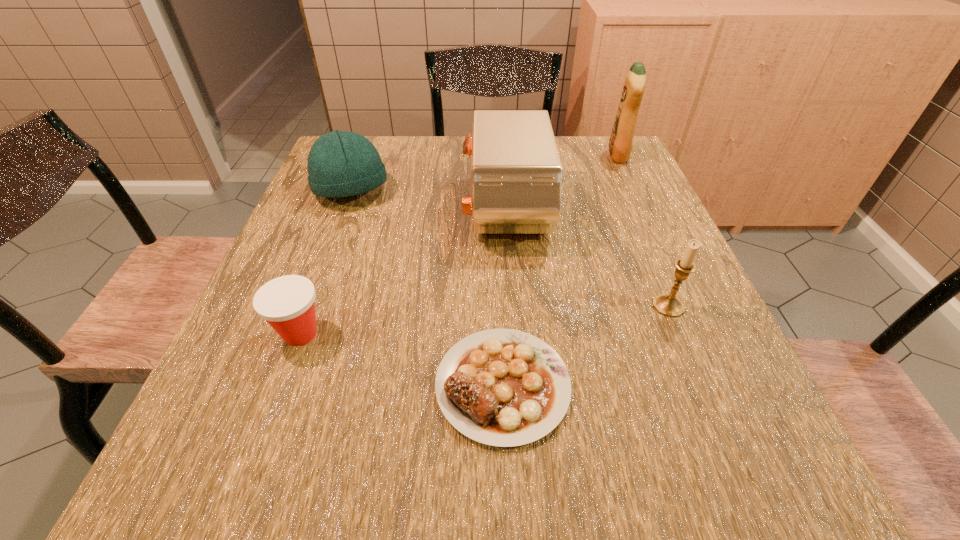
This screenshot has height=540, width=960. I want to click on empty space between the detergent and the candle holder, so click(x=643, y=231).

Select which object is the third closest to the candle holder. Please provide its 2D coordinates. Your answer should be formatted as a tuple, i.e. [(x, y)], where the tuple contains the x and y coordinates of a point satisfying the conditions above.

[(621, 141)]

Identify the location of the third closest object to the steak. (516, 174).

Where is `vacant space that satisfies the following two spatial constraints: 1. on the door side of the toaster oven; 2. on the back side of the candle holder`? The height and width of the screenshot is (540, 960). vacant space that satisfies the following two spatial constraints: 1. on the door side of the toaster oven; 2. on the back side of the candle holder is located at coordinates (513, 306).

This screenshot has height=540, width=960. I want to click on free point that satisfies the following two spatial constraints: 1. on the label of the tallest object; 2. on the front side of the candle holder, so click(685, 306).

What are the coordinates of `free space that satisfies the following two spatial constraints: 1. on the label of the detergent; 2. on the front side of the candle holder` in the screenshot? It's located at (685, 306).

Locate an element on the screen. This screenshot has width=960, height=540. vacant space that satisfies the following two spatial constraints: 1. on the front side of the candle holder; 2. on the right side of the beanie is located at coordinates (307, 306).